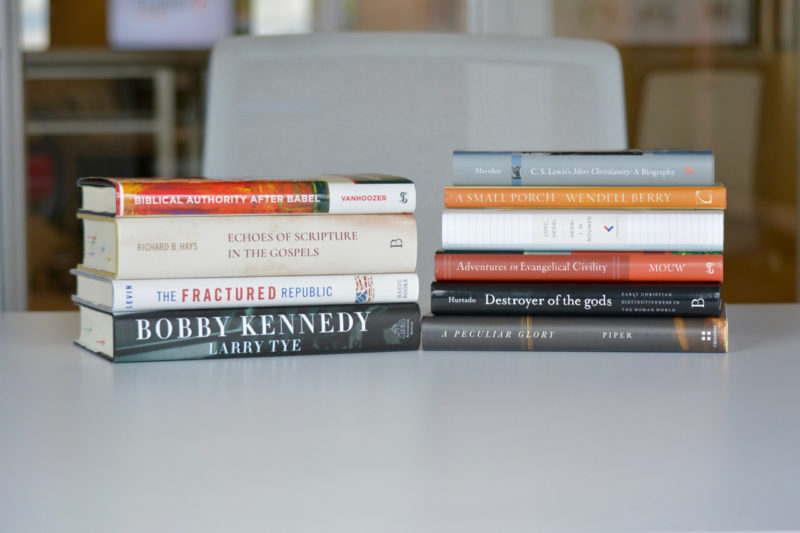
The width and height of the screenshot is (800, 533). Find the location of `books in the right stack`. books in the right stack is located at coordinates click(x=534, y=339), click(x=540, y=306), click(x=550, y=274), click(x=554, y=239), click(x=562, y=201), click(x=566, y=172).